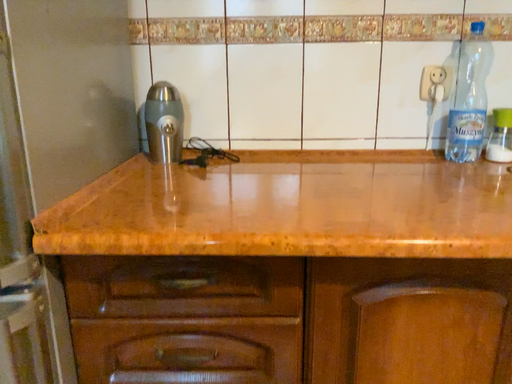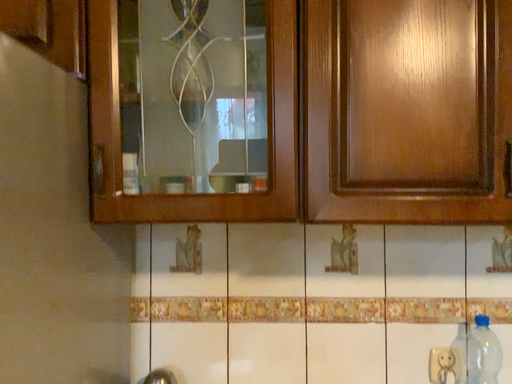
Question: How did the camera likely rotate when shooting the video?

Choices:
 (A) rotated downward
 (B) rotated upward

Answer: (B)